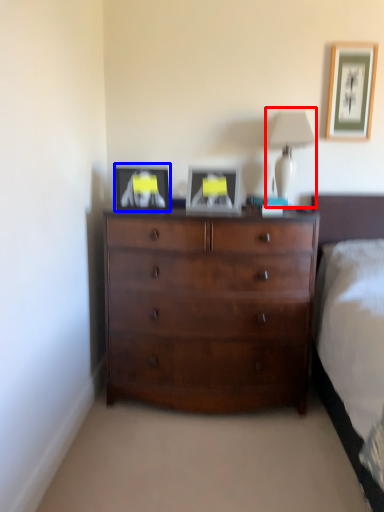
Question: Which object is further to the camera taking this photo, table lamp (highlighted by a red box) or picture frame (highlighted by a blue box)?

Choices:
 (A) table lamp
 (B) picture frame

Answer: (A)